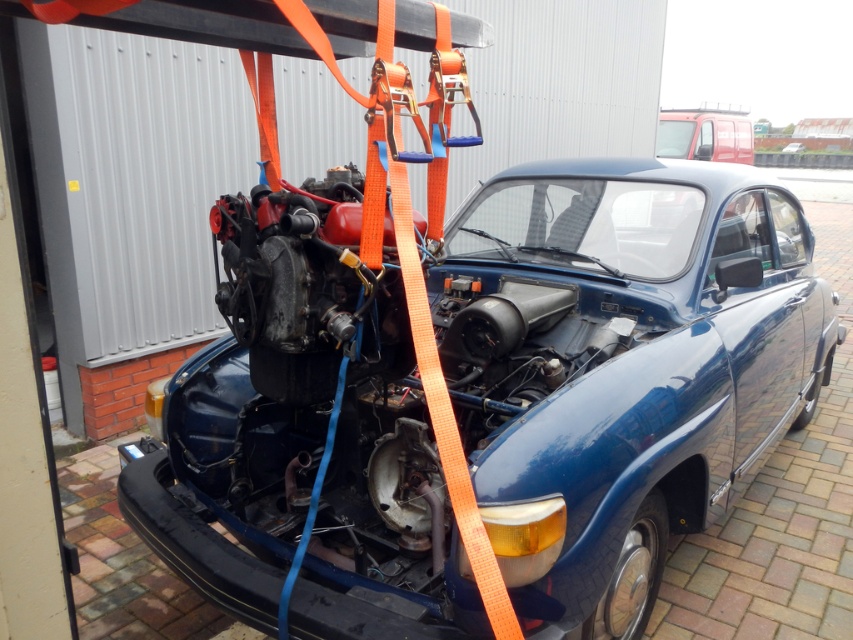
Consider the image. You are a mechanic working on a car repair. You have two cars in front of you, a glossy blue car at center and a blue matte car at center. You need to fit them into a garage that can only accommodate the wider of the two. Which car should you choose?

The glossy blue car at center has a larger width than the blue matte car at center, so you should choose the glossy blue car at center to fit into the garage.

You are a mechanic working on two cars in the garage. You need to locate the glossy blue car at center and the blue matte car at center. According to the scene, which one is positioned to the left?

The glossy blue car at center is positioned to the left of the blue matte car at center.